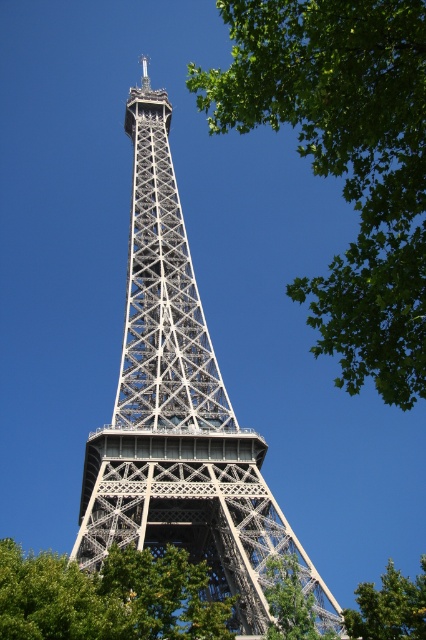
Question: Among these points, which one is nearest to the camera?

Choices:
 (A) (152, 408)
 (B) (411, 621)
 (C) (411, 138)

Answer: (C)

Question: Which of these objects is positioned farthest from the green leafy tree at center?

Choices:
 (A) green leafy tree at upper right
 (B) metallic lattice tower at center

Answer: (B)

Question: Which is farther from the green leafy tree at center?

Choices:
 (A) green leafy tree at upper right
 (B) metallic lattice tower at center

Answer: (B)

Question: Does green leafy tree at upper right have a smaller size compared to metallic lattice tower at center?

Choices:
 (A) no
 (B) yes

Answer: (A)

Question: Does green leafy tree at upper right have a lesser width compared to metallic lattice tower at center?

Choices:
 (A) no
 (B) yes

Answer: (A)

Question: Is metallic lattice tower at center closer to camera compared to green leafy tree at center?

Choices:
 (A) yes
 (B) no

Answer: (B)